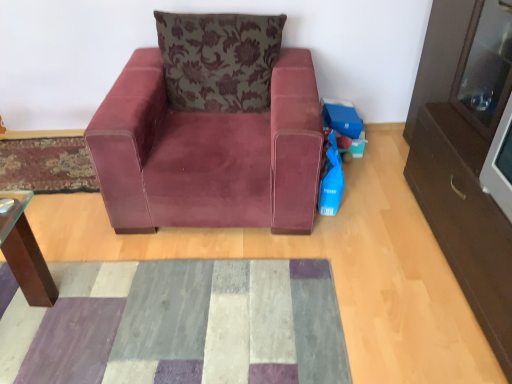
At what (x,y) coordinates should I click in order to perform the action: click on patchwork fabric mat at center, the first mat in the right-to-left sequence. Please return your answer as a coordinate pair (x, y). Looking at the image, I should click on (177, 324).

In order to face velvet floral pillow at upper center, should I rotate leftwards or rightwards?

It's best to rotate left around 4.633 degrees.

I want to click on blue plastic toy at lower right, so click(344, 126).

Describe the element at coordinates (46, 165) in the screenshot. I see `velvet-like rug at lower left, the first mat when ordered from top to bottom` at that location.

This screenshot has height=384, width=512. Describe the element at coordinates (211, 129) in the screenshot. I see `velvet maroon armchair at center` at that location.

Find the location of a particular element. patchwork fabric mat at center, placed as the first mat when sorted from bottom to top is located at coordinates (177, 324).

Would you say patchwork fabric mat at center, placed as the first mat when sorted from bottom to top, is part of velvet-like rug at lower left, the 2th mat ordered from the bottom,'s contents?

That's incorrect, patchwork fabric mat at center, placed as the first mat when sorted from bottom to top, is not inside velvet-like rug at lower left, the 2th mat ordered from the bottom.

From the image's perspective, which is below, velvet-like rug at lower left, the 1th mat in the back-to-front sequence, or patchwork fabric mat at center, the first mat in the right-to-left sequence?

patchwork fabric mat at center, the first mat in the right-to-left sequence, is shown below in the image.

Is point (6, 165) farther from camera compared to point (82, 329)?

Yes, point (6, 165) is farther from viewer.

Is patchwork fabric mat at center, which is the 2th mat in back-to-front order, not close to velvet floral pillow at upper center?

patchwork fabric mat at center, which is the 2th mat in back-to-front order, is far away from velvet floral pillow at upper center.

From the image's perspective, which one is positioned higher, patchwork fabric mat at center, the first mat in the right-to-left sequence, or velvet floral pillow at upper center?

From the image's view, velvet floral pillow at upper center is above.

Considering the sizes of patchwork fabric mat at center, placed as the 2th mat when sorted from top to bottom, and velvet floral pillow at upper center in the image, is patchwork fabric mat at center, placed as the 2th mat when sorted from top to bottom, taller or shorter than velvet floral pillow at upper center?

Clearly, patchwork fabric mat at center, placed as the 2th mat when sorted from top to bottom, is shorter compared to velvet floral pillow at upper center.

Is patchwork fabric mat at center, which ranks as the second mat in left-to-right order, to the right of velvet floral pillow at upper center from the viewer's perspective?

Incorrect, patchwork fabric mat at center, which ranks as the second mat in left-to-right order, is not on the right side of velvet floral pillow at upper center.

How many degrees apart are the facing directions of blue plastic toy at lower right and velvet floral pillow at upper center?

The facing directions of blue plastic toy at lower right and velvet floral pillow at upper center are 4.03 degrees apart.

From a real-world perspective, does blue plastic toy at lower right stand above velvet floral pillow at upper center?

Incorrect, from a real-world perspective, blue plastic toy at lower right is lower than velvet floral pillow at upper center.

Is blue plastic toy at lower right wider than velvet floral pillow at upper center?

Incorrect, the width of blue plastic toy at lower right does not surpass that of velvet floral pillow at upper center.

Looking at this image, considering the sizes of blue plastic toy at lower right and velvet floral pillow at upper center in the image, is blue plastic toy at lower right taller or shorter than velvet floral pillow at upper center?

In the image, blue plastic toy at lower right appears to be shorter than velvet floral pillow at upper center.

Is velvet maroon armchair at center facing away from velvet floral pillow at upper center?

Yes.

Can velvet floral pillow at upper center be found inside velvet maroon armchair at center?

Yes, velvet floral pillow at upper center can be found within velvet maroon armchair at center.

Who is taller, velvet maroon armchair at center or velvet floral pillow at upper center?

Standing taller between the two is velvet maroon armchair at center.

Relative to velvet floral pillow at upper center, is velvet maroon armchair at center in front or behind?

Clearly, velvet maroon armchair at center is in front of velvet floral pillow at upper center.

Which object is more forward, velvet-like rug at lower left, which appears as the 1th mat when viewed from the left, or velvet floral pillow at upper center?

velvet floral pillow at upper center is more forward.

Consider the image. Is velvet-like rug at lower left, the second mat viewed from the front, turned away from velvet floral pillow at upper center?

No, velvet-like rug at lower left, the second mat viewed from the front, is not facing the opposite direction of velvet floral pillow at upper center.

Is velvet-like rug at lower left, the 2th mat ordered from the bottom, situated inside velvet floral pillow at upper center or outside?

velvet-like rug at lower left, the 2th mat ordered from the bottom, is located beyond the bounds of velvet floral pillow at upper center.

Looking at this image, considering the relative sizes of velvet-like rug at lower left, the second mat viewed from the front, and velvet floral pillow at upper center in the image provided, is velvet-like rug at lower left, the second mat viewed from the front, shorter than velvet floral pillow at upper center?

Correct, velvet-like rug at lower left, the second mat viewed from the front, is not as tall as velvet floral pillow at upper center.

Which point is more distant from viewer, (90, 166) or (186, 218)?

The point (90, 166) is farther.

Do you think velvet-like rug at lower left, the 2th mat ordered from the bottom, is within velvet maroon armchair at center, or outside of it?

velvet-like rug at lower left, the 2th mat ordered from the bottom, lies outside velvet maroon armchair at center.

Is velvet-like rug at lower left, the 1th mat in the back-to-front sequence, in front of velvet maroon armchair at center?

That is False.

Is velvet-like rug at lower left, the 1th mat in the back-to-front sequence, not close to velvet maroon armchair at center?

velvet-like rug at lower left, the 1th mat in the back-to-front sequence, is actually quite close to velvet maroon armchair at center.

From a real-world perspective, is blue plastic toy at lower right positioned under velvet maroon armchair at center based on gravity?

Indeed, from a real-world perspective, blue plastic toy at lower right is positioned beneath velvet maroon armchair at center.

Does blue plastic toy at lower right have a greater height compared to velvet maroon armchair at center?

Incorrect, the height of blue plastic toy at lower right is not larger of that of velvet maroon armchair at center.

Looking at this image, is blue plastic toy at lower right not within velvet maroon armchair at center?

blue plastic toy at lower right is positioned outside velvet maroon armchair at center.

Based on the photo, how far apart are blue plastic toy at lower right and velvet maroon armchair at center?

They are 29.80 inches apart.

Identify the location of mat that appears on the right of velvet-like rug at lower left, the second mat viewed from the front. This screenshot has height=384, width=512. (177, 324).

The image size is (512, 384). Identify the location of pillow above the patchwork fabric mat at center, the first mat in the right-to-left sequence (from a real-world perspective). (219, 60).

Considering their positions, is blue plastic toy at lower right positioned closer to velvet floral pillow at upper center than patchwork fabric mat at center, placed as the first mat when sorted from bottom to top?

Based on the image, blue plastic toy at lower right appears to be nearer to velvet floral pillow at upper center.

Looking at the image, which one is located further to velvet floral pillow at upper center, patchwork fabric mat at center, placed as the first mat when sorted from bottom to top, or velvet-like rug at lower left, which appears as the 1th mat when viewed from the left?

The object further to velvet floral pillow at upper center is patchwork fabric mat at center, placed as the first mat when sorted from bottom to top.

From the image, which object appears to be nearer to velvet maroon armchair at center, velvet-like rug at lower left, which is the second mat from right to left, or blue plastic toy at lower right?

The object closer to velvet maroon armchair at center is blue plastic toy at lower right.

Looking at the image, which one is located further to patchwork fabric mat at center, the first mat in the right-to-left sequence, blue plastic toy at lower right or velvet maroon armchair at center?

Based on the image, blue plastic toy at lower right appears to be further to patchwork fabric mat at center, the first mat in the right-to-left sequence.

Considering their positions, is velvet maroon armchair at center positioned further to blue plastic toy at lower right than patchwork fabric mat at center, which is the 2th mat in back-to-front order?

patchwork fabric mat at center, which is the 2th mat in back-to-front order, lies further to blue plastic toy at lower right than the other object.

From the image, which object appears to be farther from velvet maroon armchair at center, velvet-like rug at lower left, which appears as the 1th mat when viewed from the left, or velvet floral pillow at upper center?

velvet-like rug at lower left, which appears as the 1th mat when viewed from the left, is positioned further to the anchor velvet maroon armchair at center.

When comparing their distances from velvet maroon armchair at center, does velvet floral pillow at upper center or patchwork fabric mat at center, which ranks as the second mat in left-to-right order, seem closer?

velvet floral pillow at upper center.

Which object lies further to the anchor point velvet floral pillow at upper center, velvet-like rug at lower left, the 1th mat in the back-to-front sequence, or patchwork fabric mat at center, placed as the first mat when sorted from bottom to top?

patchwork fabric mat at center, placed as the first mat when sorted from bottom to top, lies further to velvet floral pillow at upper center than the other object.

Locate an element on the screen. mat located between velvet-like rug at lower left, which appears as the 1th mat when viewed from the left, and velvet maroon armchair at center in the left-right direction is located at coordinates (177, 324).

The image size is (512, 384). I want to click on mat between velvet-like rug at lower left, the second mat viewed from the front, and blue plastic toy at lower right from left to right, so click(x=177, y=324).

Identify the location of chair that lies between velvet floral pillow at upper center and patchwork fabric mat at center, the first mat in the right-to-left sequence, from top to bottom. Image resolution: width=512 pixels, height=384 pixels. (211, 129).

Identify the location of mat between velvet floral pillow at upper center and patchwork fabric mat at center, which is counted as the first mat, starting from the front, vertically. (46, 165).